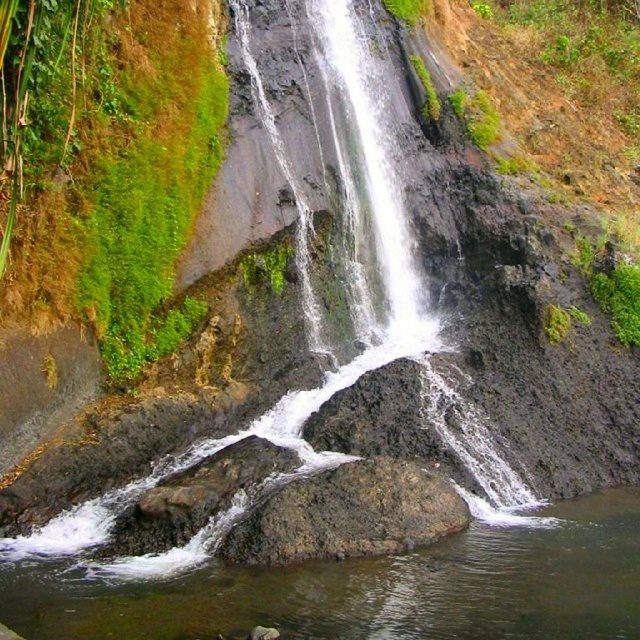
What do you see at coordinates (109, 168) in the screenshot? I see `green mossy rock at left` at bounding box center [109, 168].

Does green mossy rock at left have a larger size compared to clear water at rock center?

Yes, green mossy rock at left is bigger than clear water at rock center.

The image size is (640, 640). What do you see at coordinates (109, 168) in the screenshot? I see `green mossy rock at left` at bounding box center [109, 168].

In order to click on green mossy rock at left in this screenshot , I will do `click(109, 168)`.

Is point (422, 612) positioned before point (419, 470)?

Yes, point (422, 612) is in front of point (419, 470).

Locate an element on the screen. This screenshot has height=640, width=640. clear water at rock center is located at coordinates (364, 588).

Can you confirm if green mossy rock at left is thinner than gray rough rock at center?

Yes.

Can you confirm if green mossy rock at left is shorter than gray rough rock at center?

Incorrect, green mossy rock at left's height does not fall short of gray rough rock at center's.

Between point (120, 275) and point (438, 474), which one is positioned in front?

Positioned in front is point (438, 474).

The height and width of the screenshot is (640, 640). I want to click on green mossy rock at left, so click(109, 168).